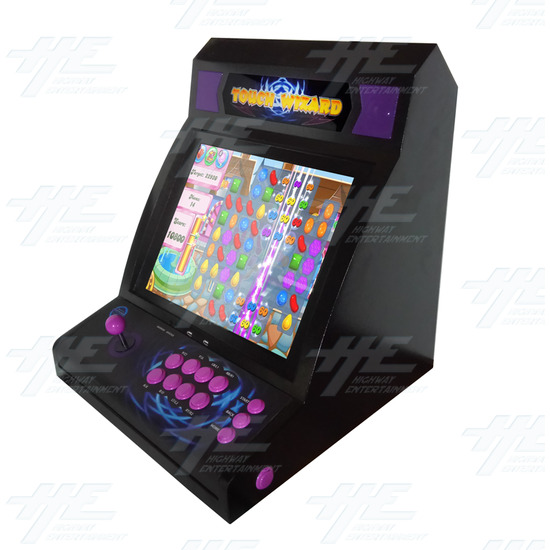
The height and width of the screenshot is (550, 550). Identify the location of screen. (245, 249).